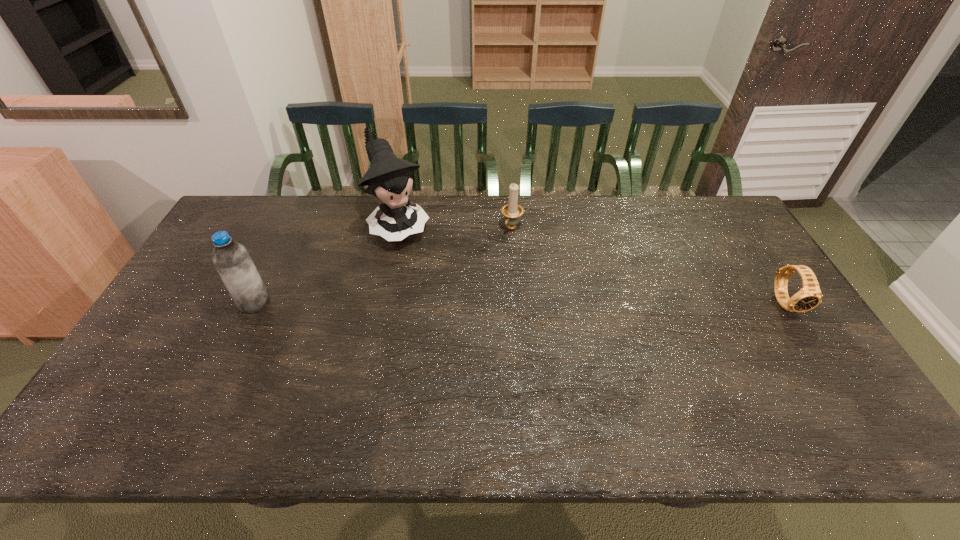
Find the location of a particular element. vacant space at the near edge of the desktop is located at coordinates (441, 379).

In order to click on free space at the left edge of the desktop in this screenshot , I will do `click(196, 283)`.

In the image, there is a desktop. Identify the location of vacant space at the right edge. This screenshot has width=960, height=540. (761, 264).

In the image, there is a desktop. Find the location of `vacant region at the far left corner`. vacant region at the far left corner is located at coordinates (233, 220).

Where is `vacant area at the far right corner of the desktop`? The width and height of the screenshot is (960, 540). vacant area at the far right corner of the desktop is located at coordinates (728, 228).

Find the location of a particular element. The image size is (960, 540). free space between the second tallest object and the candle_holder is located at coordinates (383, 265).

Identify the location of unoccupied position between the rightmost object and the doll. (592, 265).

You are a GUI agent. You are given a task and a screenshot of the screen. Output one action in this format:
    pyautogui.click(x=<x>, y=<y>)
    Task: Click on the free point between the water bottle and the doll
    The image size is (960, 540).
    Given the screenshot: What is the action you would take?
    pyautogui.click(x=327, y=265)

Where is `vacant space that's between the water bottle and the third object from left to right`? This screenshot has height=540, width=960. vacant space that's between the water bottle and the third object from left to right is located at coordinates (383, 265).

Find the location of a particular element. This screenshot has width=960, height=540. empty location between the third tallest object and the water bottle is located at coordinates (383, 265).